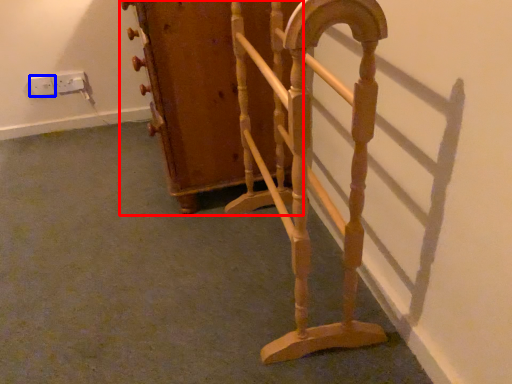
Question: Among these objects, which one is nearest to the camera, furniture (highlighted by a red box) or electric outlet (highlighted by a blue box)?

Choices:
 (A) furniture
 (B) electric outlet

Answer: (A)